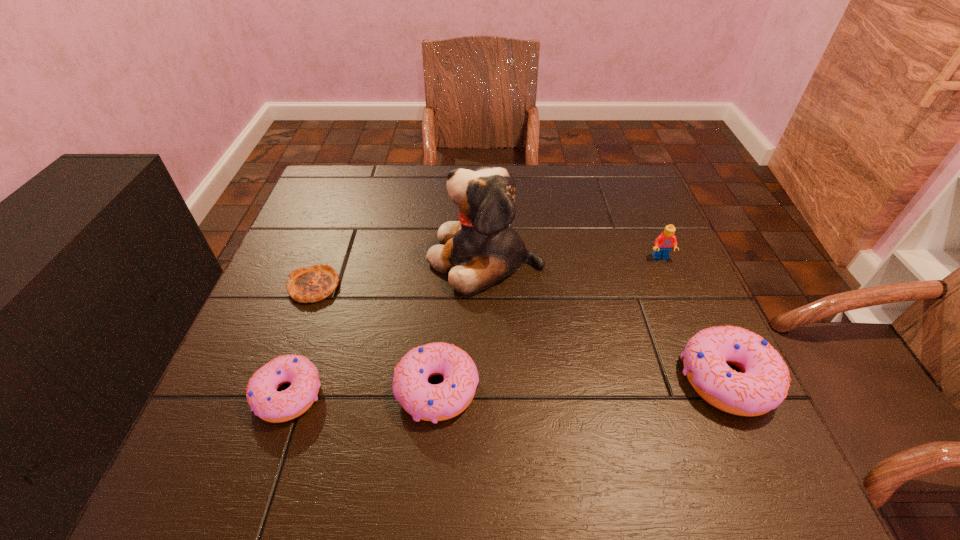
Locate an element on the screen. This screenshot has width=960, height=540. vacant position for inserting another doughnut evenly is located at coordinates (584, 384).